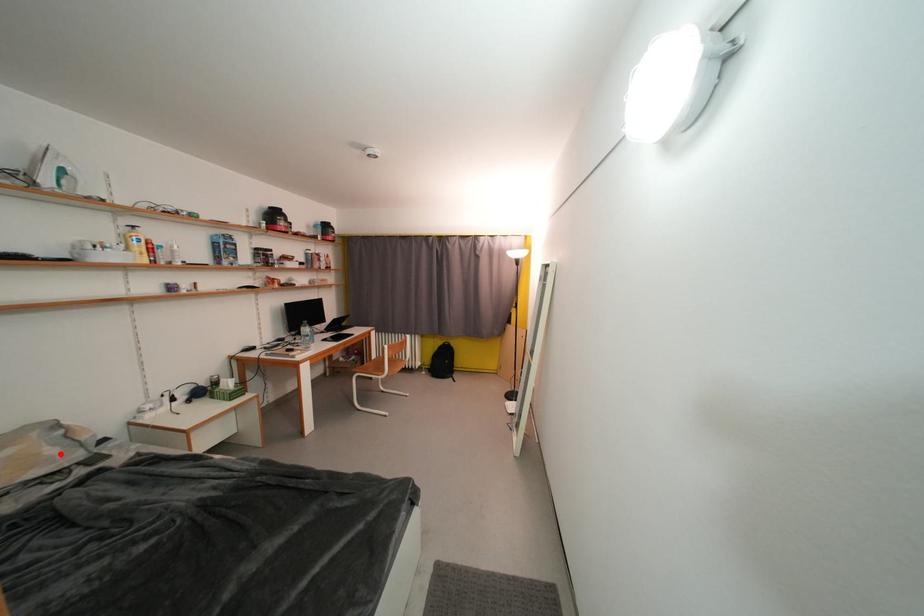
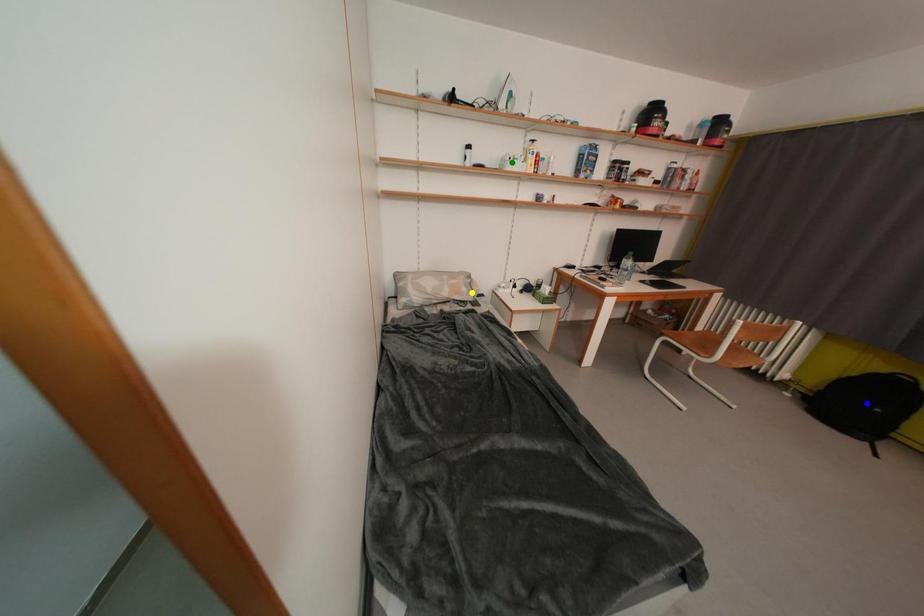
Question: I am providing you with two images of the same scene from different viewpoints. A red point is marked on the first image. You are given multiple points on the second image. Which mark in image 2 goes with the point in image 1?

Choices:
 (A) yellow point
 (B) green point
 (C) blue point

Answer: (A)